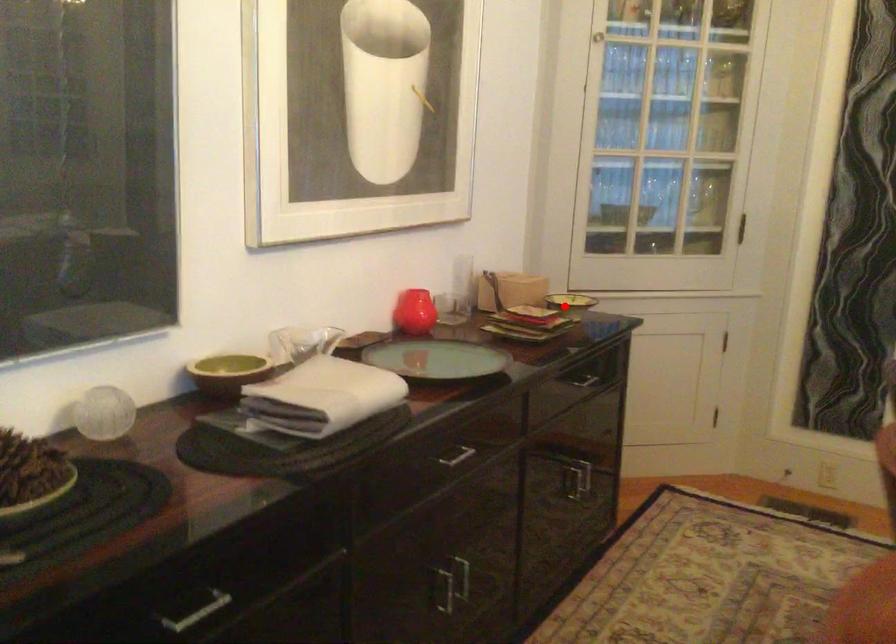
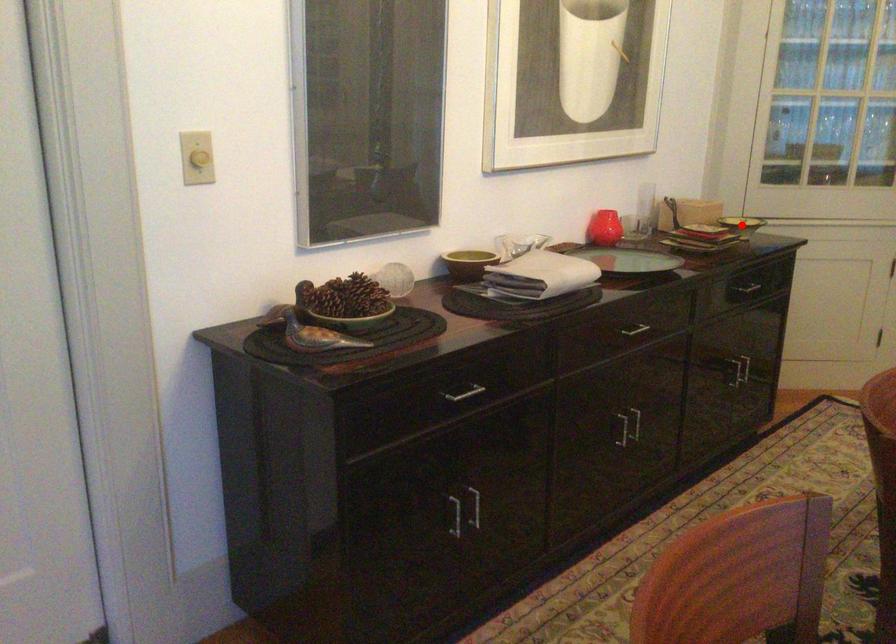
I am providing you with two images of the same scene from different viewpoints. A red point is marked on the first image and another point is marked on the second image. Do the highlighted points in image1 and image2 indicate the same real-world spot?

Yes